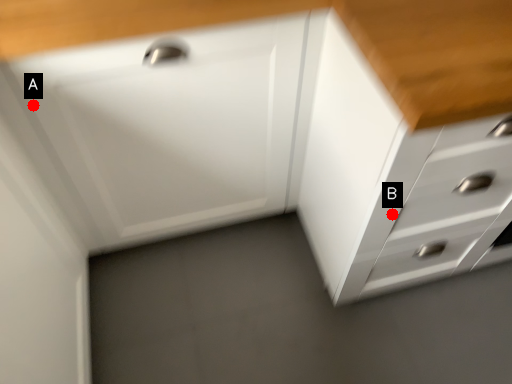
Question: Two points are circled on the image, labeled by A and B beside each circle. Which point is further to the camera?

Choices:
 (A) A is further
 (B) B is further

Answer: (B)